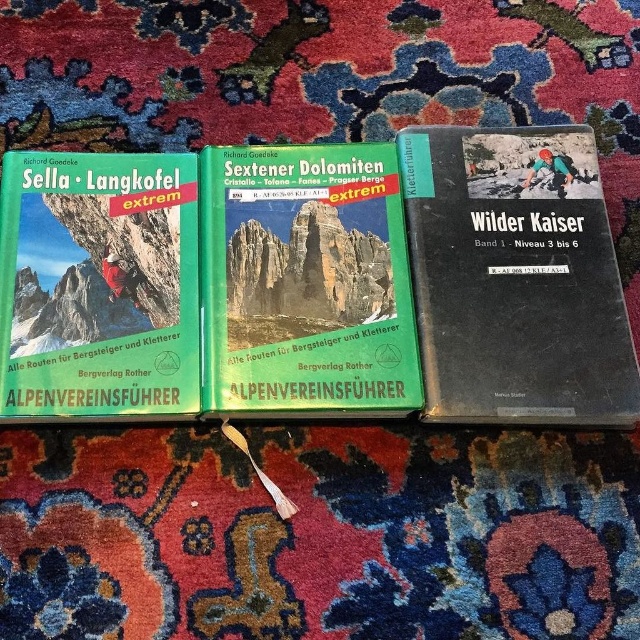
Question: Which point appears closest to the camera in this image?

Choices:
 (A) (284, 166)
 (B) (170, 177)

Answer: (B)

Question: Which point is farther to the camera?

Choices:
 (A) (212, 205)
 (B) (497, 342)
 (C) (81, 220)

Answer: (A)

Question: Is green matte book at center above green matte book at left?

Choices:
 (A) no
 (B) yes

Answer: (B)

Question: From the image, what is the correct spatial relationship of black matte book at right in relation to green matte book at center?

Choices:
 (A) left
 (B) right

Answer: (B)

Question: Considering the real-world distances, which object is closest to the black matte book at right?

Choices:
 (A) green matte book at center
 (B) green matte book at left

Answer: (A)

Question: From the image, what is the correct spatial relationship of black matte book at right in relation to green matte book at center?

Choices:
 (A) right
 (B) left

Answer: (A)